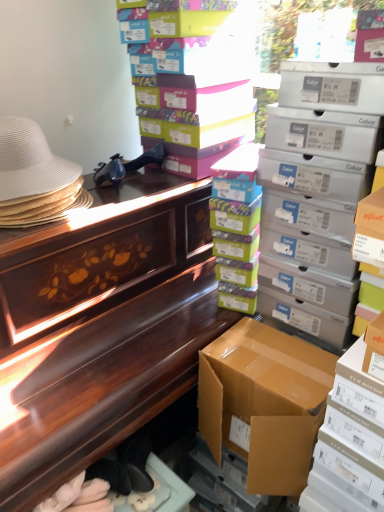
What do you see at coordinates (264, 403) in the screenshot? I see `brown cardboard box at lower right, positioned as the fourth box in top-to-bottom order` at bounding box center [264, 403].

Locate an element on the screen. wooden desk at upper left is located at coordinates (103, 326).

This screenshot has width=384, height=512. Describe the element at coordinates (103, 326) in the screenshot. I see `wooden desk at upper left` at that location.

What is the approximate width of multicolored cardboard box at upper center, the fifth box in the bottom-to-top sequence?

multicolored cardboard box at upper center, the fifth box in the bottom-to-top sequence, is 16.13 inches in width.

Find the location of `matte cardboard box at upper right, which is counted as the 4th box, starting from the bottom`. matte cardboard box at upper right, which is counted as the 4th box, starting from the bottom is located at coordinates (318, 188).

Locate an element on the screen. white woven hat at left is located at coordinates (30, 162).

This screenshot has height=512, width=384. What are the coordinates of `brown cardboard box at lower right, the 2th box in the bottom-to-top sequence` in the screenshot? It's located at (264, 403).

Between multicolored cardboard box at upper center, which ranks as the 1th box in top-to-bottom order, and white woven hat at left, which one has more height?

multicolored cardboard box at upper center, which ranks as the 1th box in top-to-bottom order, is taller.

Is multicolored cardboard box at upper center, the fifth box in the bottom-to-top sequence, wider than white woven hat at left?

Yes.

Looking at this image, is multicolored cardboard box at upper center, which ranks as the 1th box in top-to-bottom order, not close to white woven hat at left?

No.

From the image's perspective, is multicolored cardboard box at upper center, the fifth box in the bottom-to-top sequence, positioned above or below white woven hat at left?

multicolored cardboard box at upper center, the fifth box in the bottom-to-top sequence, is situated higher than white woven hat at left in the image.

From a real-world perspective, between multicolored cardboard box at upper center, the fifth box in the bottom-to-top sequence, and multicolored cardboard boxes at center, the 3th box positioned from the top, who is vertically higher?

multicolored cardboard box at upper center, the fifth box in the bottom-to-top sequence, from a real-world perspective.

Would you say multicolored cardboard box at upper center, which ranks as the 1th box in top-to-bottom order, is outside multicolored cardboard boxes at center, the 3th box positioned from the top?

Yes.

Considering the sizes of multicolored cardboard box at upper center, the fifth box in the bottom-to-top sequence, and multicolored cardboard boxes at center, acting as the 3th box starting from the bottom, in the image, is multicolored cardboard box at upper center, the fifth box in the bottom-to-top sequence, wider or thinner than multicolored cardboard boxes at center, acting as the 3th box starting from the bottom,?

In the image, multicolored cardboard box at upper center, the fifth box in the bottom-to-top sequence, appears to be wider than multicolored cardboard boxes at center, acting as the 3th box starting from the bottom.

Is multicolored cardboard box at upper center, which ranks as the 1th box in top-to-bottom order, far from multicolored cardboard boxes at center, acting as the 3th box starting from the bottom?

No.

Considering the positions of points (28, 182) and (345, 403), is point (28, 182) farther from camera compared to point (345, 403)?

Yes, it is behind point (345, 403).

Is there a large distance between white woven hat at left and brown cardboard box at right, which is the 5th box from top to bottom?

No, there isn't a large distance between white woven hat at left and brown cardboard box at right, which is the 5th box from top to bottom.

From a real-world perspective, does white woven hat at left sit lower than brown cardboard box at right, which is the first box from bottom to top?

No.

Locate an element on the screen. the 2nd box in front of the white woven hat at left is located at coordinates (350, 441).

Locate an element on the screen. This screenshot has height=512, width=384. the 3rd box to the right of the multicolored cardboard boxes at center, acting as the 3th box starting from the bottom, counting from the anchor's position is located at coordinates (350, 441).

From a real-world perspective, who is located higher, brown cardboard box at right, which is the first box from bottom to top, or multicolored cardboard boxes at center, the 3th box positioned from the top?

multicolored cardboard boxes at center, the 3th box positioned from the top.

Looking at this image, could you tell me if brown cardboard box at right, which is the first box from bottom to top, is facing multicolored cardboard boxes at center, acting as the 3th box starting from the bottom?

No, brown cardboard box at right, which is the first box from bottom to top, is not facing towards multicolored cardboard boxes at center, acting as the 3th box starting from the bottom.

Is the surface of brown cardboard box at right, which is the first box from bottom to top, in direct contact with multicolored cardboard boxes at center, acting as the 3th box starting from the bottom?

No.

From the image's perspective, is matte cardboard box at upper right, marked as the second box in a top-to-bottom arrangement, located beneath wooden desk at upper left?

No, from the image's perspective, matte cardboard box at upper right, marked as the second box in a top-to-bottom arrangement, is not below wooden desk at upper left.

Based on the photo, are matte cardboard box at upper right, marked as the second box in a top-to-bottom arrangement, and wooden desk at upper left far apart?

They are positioned close to each other.

Considering the points (326, 250) and (157, 335), which point is behind, point (326, 250) or point (157, 335)?

The point (157, 335) is farther.

Can you confirm if matte cardboard box at upper right, which is counted as the 4th box, starting from the bottom, is positioned to the left of wooden desk at upper left?

No, matte cardboard box at upper right, which is counted as the 4th box, starting from the bottom, is not to the left of wooden desk at upper left.

Between point (177, 267) and point (328, 425), which one is positioned behind?

Positioned behind is point (177, 267).

Is wooden desk at upper left next to brown cardboard box at right, which is the first box from bottom to top?

No.

Can you confirm if wooden desk at upper left is bigger than brown cardboard box at right, which is the 5th box from top to bottom?

Correct, wooden desk at upper left is larger in size than brown cardboard box at right, which is the 5th box from top to bottom.

Is wooden desk at upper left taller than brown cardboard box at right, which is the 5th box from top to bottom?

Yes.

Considering the relative sizes of white woven hat at left and matte cardboard box at upper right, marked as the second box in a top-to-bottom arrangement, in the image provided, is white woven hat at left taller than matte cardboard box at upper right, marked as the second box in a top-to-bottom arrangement,?

No, white woven hat at left is not taller than matte cardboard box at upper right, marked as the second box in a top-to-bottom arrangement.

Does point (23, 173) come farther from viewer compared to point (297, 109)?

That is False.

The width and height of the screenshot is (384, 512). Identify the location of the 1st box positioned below the white woven hat at left (from the image's perspective). (318, 188).

How different are the orientations of white woven hat at left and matte cardboard box at upper right, which is counted as the 4th box, starting from the bottom, in degrees?

There is a 90-degree angle between the facing directions of white woven hat at left and matte cardboard box at upper right, which is counted as the 4th box, starting from the bottom.

Locate an element on the screen. hat that appears below the multicolored cardboard box at upper center, the fifth box in the bottom-to-top sequence (from a real-world perspective) is located at coordinates (30, 162).

Image resolution: width=384 pixels, height=512 pixels. What are the coordinates of `box on the left of multicolored cardboard boxes at center, the 3th box positioned from the top` in the screenshot? It's located at (191, 81).

When comparing their distances from multicolored cardboard box at upper center, the fifth box in the bottom-to-top sequence, does matte cardboard box at upper right, which is counted as the 4th box, starting from the bottom, or brown cardboard box at lower right, positioned as the fourth box in top-to-bottom order, seem closer?

matte cardboard box at upper right, which is counted as the 4th box, starting from the bottom, lies closer to multicolored cardboard box at upper center, the fifth box in the bottom-to-top sequence, than the other object.

Based on their spatial positions, is multicolored cardboard boxes at center, the 3th box positioned from the top, or multicolored cardboard box at upper center, the fifth box in the bottom-to-top sequence, further from white woven hat at left?

multicolored cardboard boxes at center, the 3th box positioned from the top.

Which object lies further to the anchor point multicolored cardboard box at upper center, which ranks as the 1th box in top-to-bottom order, brown cardboard box at lower right, positioned as the fourth box in top-to-bottom order, or brown cardboard box at right, which is the 5th box from top to bottom?

Among the two, brown cardboard box at right, which is the 5th box from top to bottom, is located further to multicolored cardboard box at upper center, which ranks as the 1th box in top-to-bottom order.

Looking at the image, which one is located closer to multicolored cardboard boxes at center, the 3th box positioned from the top, white woven hat at left or brown cardboard box at lower right, the 2th box in the bottom-to-top sequence?

The object closer to multicolored cardboard boxes at center, the 3th box positioned from the top, is brown cardboard box at lower right, the 2th box in the bottom-to-top sequence.

Consider the image. Which object lies further to the anchor point brown cardboard box at lower right, the 2th box in the bottom-to-top sequence, matte cardboard box at upper right, which is counted as the 4th box, starting from the bottom, or multicolored cardboard box at upper center, which ranks as the 1th box in top-to-bottom order?

multicolored cardboard box at upper center, which ranks as the 1th box in top-to-bottom order, is further to brown cardboard box at lower right, the 2th box in the bottom-to-top sequence.

Considering their positions, is multicolored cardboard boxes at center, the 3th box positioned from the top, positioned closer to multicolored cardboard box at upper center, which ranks as the 1th box in top-to-bottom order, than wooden desk at upper left?

multicolored cardboard boxes at center, the 3th box positioned from the top.

Which object lies nearer to the anchor point white woven hat at left, wooden desk at upper left or multicolored cardboard box at upper center, the fifth box in the bottom-to-top sequence?

Among the two, wooden desk at upper left is located nearer to white woven hat at left.

When comparing their distances from matte cardboard box at upper right, which is counted as the 4th box, starting from the bottom, does brown cardboard box at lower right, the 2th box in the bottom-to-top sequence, or brown cardboard box at right, which is the first box from bottom to top, seem further?

brown cardboard box at right, which is the first box from bottom to top.

I want to click on desk between white woven hat at left and multicolored cardboard boxes at center, the 3th box positioned from the top, so click(103, 326).

Where is `desk between multicolored cardboard box at upper center, which ranks as the 1th box in top-to-bottom order, and brown cardboard box at right, which is the 5th box from top to bottom, in the up-down direction`? The height and width of the screenshot is (512, 384). desk between multicolored cardboard box at upper center, which ranks as the 1th box in top-to-bottom order, and brown cardboard box at right, which is the 5th box from top to bottom, in the up-down direction is located at coordinates (103, 326).

Where is `box situated between white woven hat at left and multicolored cardboard boxes at center, acting as the 3th box starting from the bottom, from left to right`? The width and height of the screenshot is (384, 512). box situated between white woven hat at left and multicolored cardboard boxes at center, acting as the 3th box starting from the bottom, from left to right is located at coordinates (191, 81).

This screenshot has height=512, width=384. I want to click on desk between white woven hat at left and brown cardboard box at right, which is the 5th box from top to bottom, from left to right, so click(103, 326).